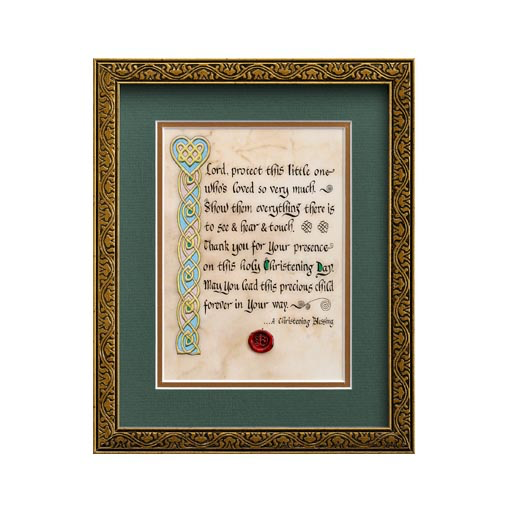
The image size is (508, 511). In order to click on patterned border in this screenshot , I will do `click(188, 266)`.